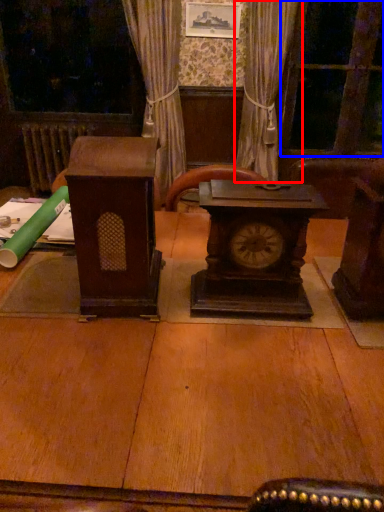
Question: Which object is closer to the camera taking this photo, curtain (highlighted by a red box) or glass door (highlighted by a blue box)?

Choices:
 (A) curtain
 (B) glass door

Answer: (A)